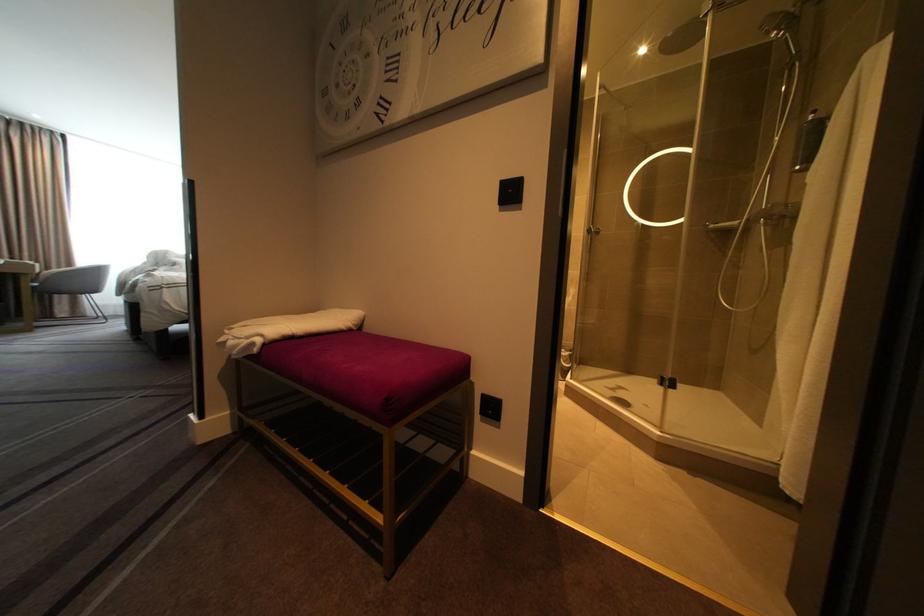
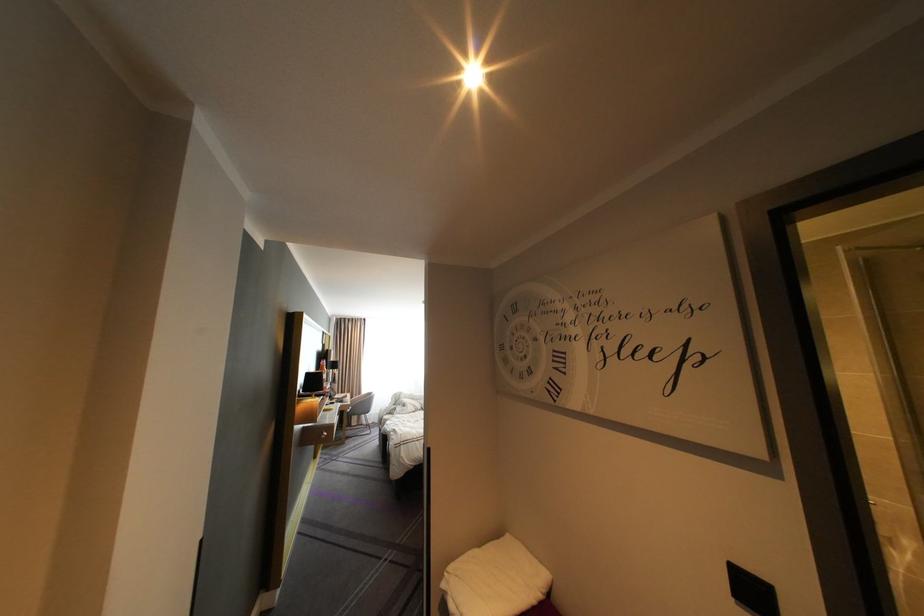
Find the pixel in the second image that matches (512,211) in the first image.

(748, 604)